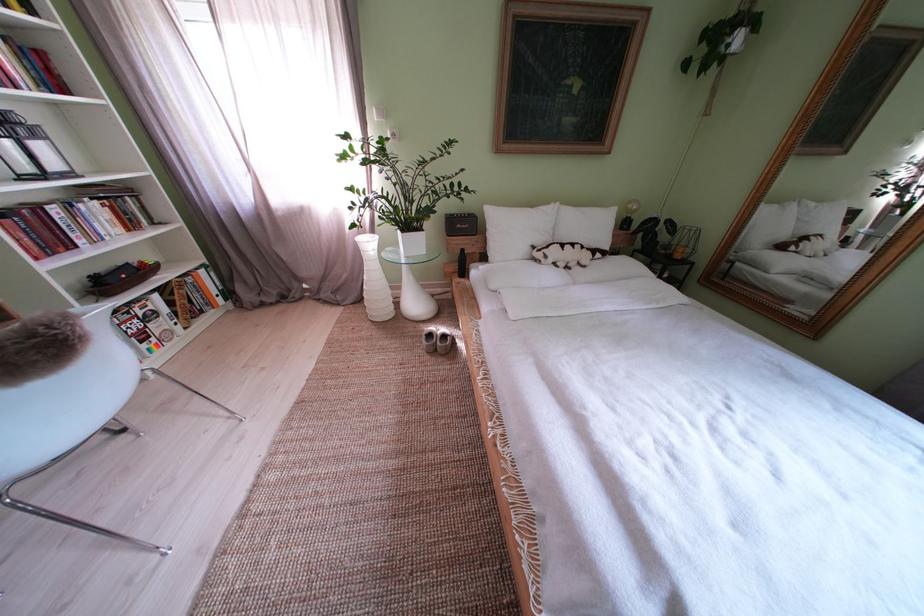
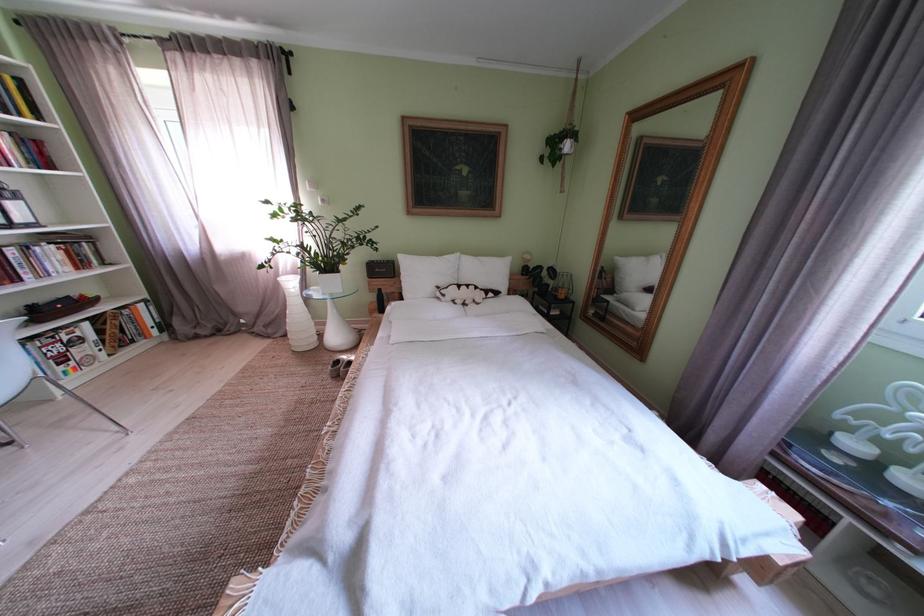
Locate, in the second image, the point that corresponds to (x=415, y=237) in the first image.

(333, 278)